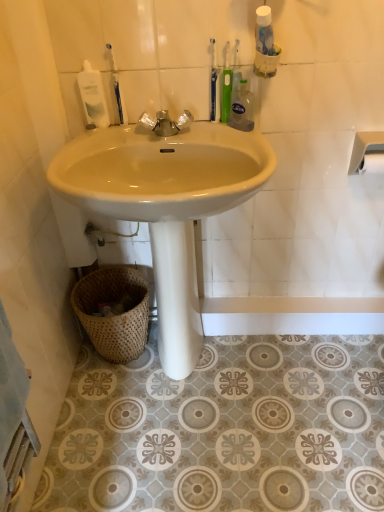
I want to click on free space to the right of blue plastic toothbrush at upper left, marked as the first toothbrush in a left-to-right arrangement, so click(x=177, y=134).